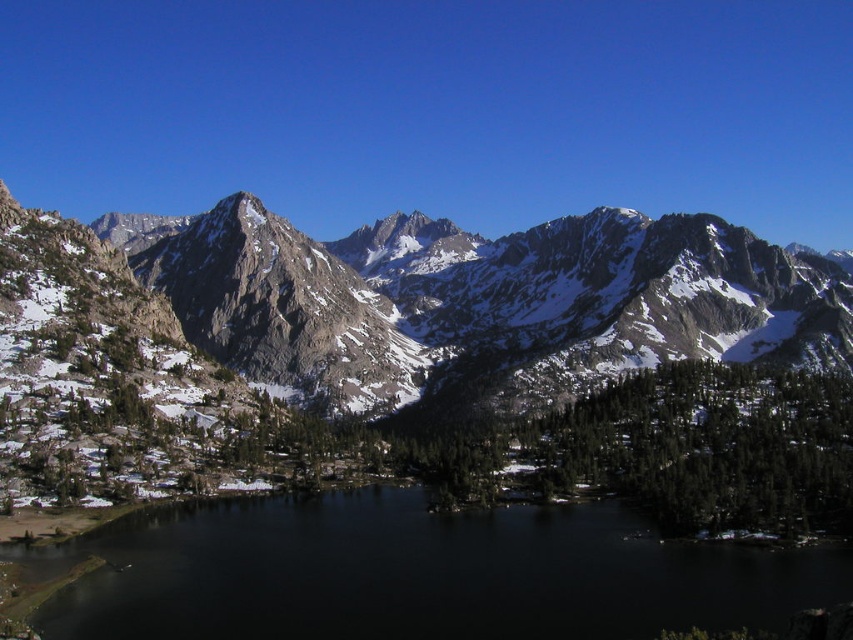
Does rocky gray mountain range at center appear over black water at center?

Yes.

In the scene shown: Who is more distant from viewer, (373, 292) or (251, 632)?

Positioned behind is point (373, 292).

Find the location of a particular element. rocky gray mountain range at center is located at coordinates (434, 300).